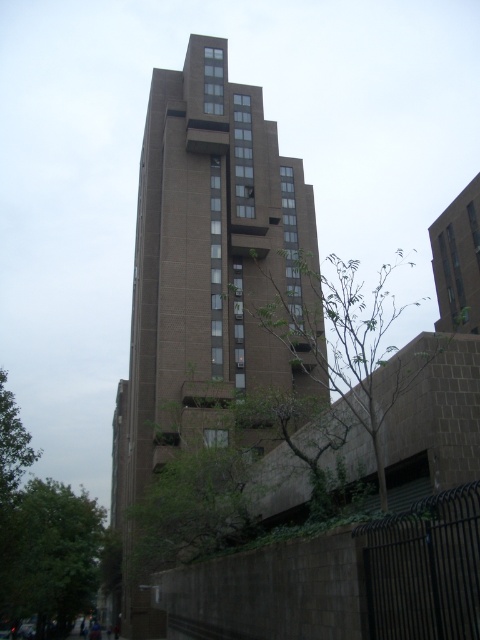
Based on the photo, measure the distance between brown concrete building at center and green leafy tree at lower left.

The distance of brown concrete building at center from green leafy tree at lower left is 26.59 meters.

Who is positioned more to the right, brown concrete building at center or green leafy tree at lower left?

From the viewer's perspective, brown concrete building at center appears more on the right side.

Between point (143, 150) and point (55, 580), which one is positioned in front?

Point (55, 580)

Locate an element on the screen. This screenshot has width=480, height=640. brown concrete building at center is located at coordinates (204, 282).

Can you confirm if green leafy tree at center is shorter than green leafy tree at lower left?

No, green leafy tree at center is not shorter than green leafy tree at lower left.

Who is positioned more to the right, green leafy tree at center or green leafy tree at lower left?

Positioned to the right is green leafy tree at center.

Does point (370, 337) come behind point (41, 540)?

No, it is not.

You are a GUI agent. You are given a task and a screenshot of the screen. Output one action in this format:
    pyautogui.click(x=<x>, y=<y>)
    Task: Click on the green leafy tree at center
    Image resolution: width=480 pixels, height=640 pixels.
    Given the screenshot: What is the action you would take?
    pyautogui.click(x=369, y=390)

Is brown concrete building at center positioned behind green leafy tree at center?

Yes, brown concrete building at center is further from the viewer.

Is brown concrete building at center above green leafy tree at center?

No, brown concrete building at center is not above green leafy tree at center.

Does point (226, 138) come closer to viewer compared to point (348, 337)?

No, (226, 138) is further to viewer.

I want to click on brown concrete building at center, so (204, 282).